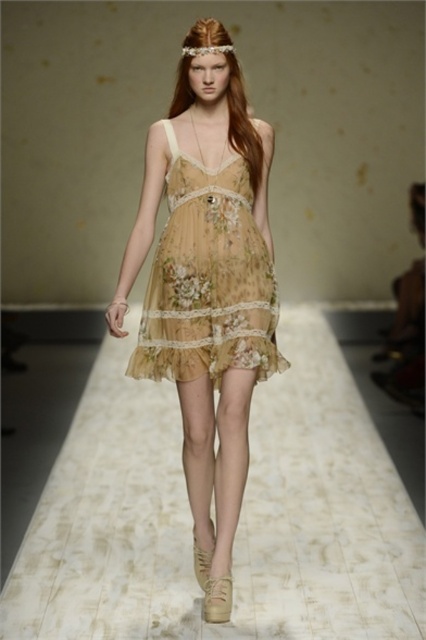
You are a photographer positioned at the back of the runway. You want to capture a clear photo of the floral chiffon dress at center without the translucent floral dress at center blocking it. Is this possible?

The translucent floral dress at center is closer to the viewer than the floral chiffon dress at center, so it will block the view of the floral chiffon dress at center. Therefore, capturing a clear photo of the floral chiffon dress at center without obstruction is not possible.

You are a photographer positioned at the end of the runway. You need to focus your camera on both the point at point [236,108] and point [203,234]. Which point is closer to your camera?

Point [236,108] is closer to the photographer because it is further to the viewer than point [203,234].

You are a photographer at the runway show and need to capture the model wearing both the translucent floral dress at center and the floral chiffon dress at center. Since both are at the center, how are they arranged vertically?

The translucent floral dress at center is below the floral chiffon dress at center, so the floral chiffon dress at center is positioned above the translucent one.